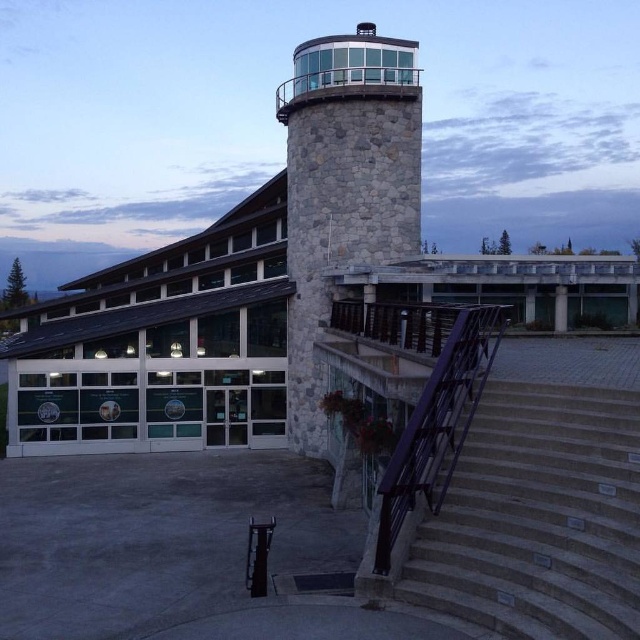
From the picture: You are standing at the entrance of the building and want to reach the observation deck. According to the image, where are the gray concrete stairs at lower right located in relation to your current position?

The gray concrete stairs at lower right are located at point (538, 516) in the image, which is to the lower right of your current position at the entrance.